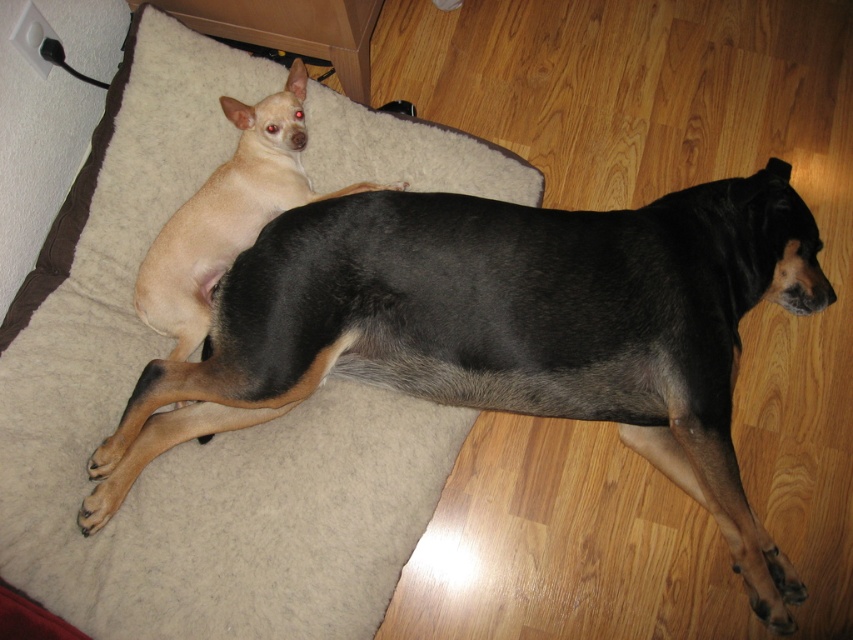
You are a pet owner who wants to buy a new dog bed for your two dogs. The current beige fleece dog bed at upper left is wider than the light beige fur at upper left. If you want to ensure both dogs can lie down comfortably side by side, which bed dimension should you prioritize when choosing a new bed?

The beige fleece dog bed at upper left is wider than the light beige fur at upper left. To accommodate both dogs comfortably side by side, prioritize a bed with a width greater than the current beige fleece dog bed at upper left to ensure sufficient space for both dogs.

You are a dog owner who wants to move the black fur dog at upper center to the beige fleece dog bed at upper left. Is the bed above or below the dog?

The beige fleece dog bed at upper left is located above the black fur dog at upper center, so the bed is above the dog.